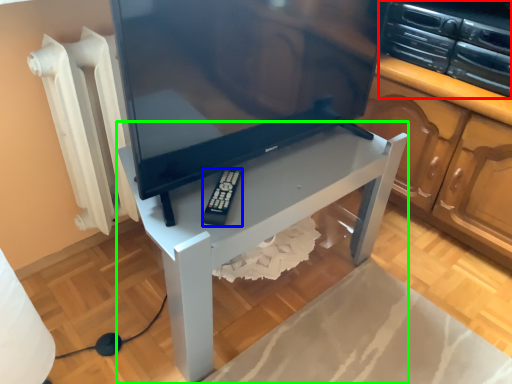
Question: Considering the real-world distances, which object is closest to appliance (highlighted by a red box)? equipment (highlighted by a blue box) or furniture (highlighted by a green box).

Choices:
 (A) equipment
 (B) furniture

Answer: (B)